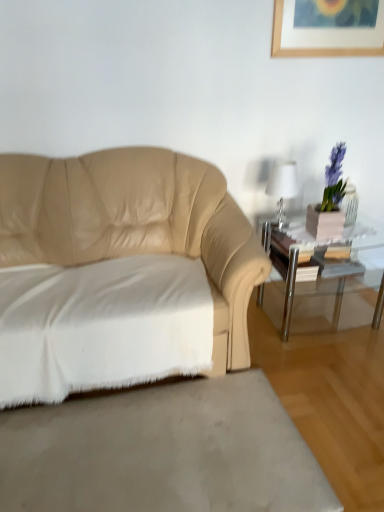
Question: From the image's perspective, relative to beige leather couch at left, is white cotton sheet at lower left above or below?

Choices:
 (A) above
 (B) below

Answer: (B)

Question: Looking at their shapes, would you say white cotton sheet at lower left is wider or thinner than beige leather couch at left?

Choices:
 (A) thin
 (B) wide

Answer: (A)

Question: Estimate the real-world distances between objects in this image. Which object is closer to the clear glass table at right?

Choices:
 (A) beige leather couch at left
 (B) white glossy table lamp at upper right
 (C) white cotton sheet at lower left
 (D) white soft rug at lower left

Answer: (B)

Question: Which object is positioned closest to the beige leather couch at left?

Choices:
 (A) white soft rug at lower left
 (B) white glossy table lamp at upper right
 (C) white cotton sheet at lower left
 (D) clear glass table at right

Answer: (C)